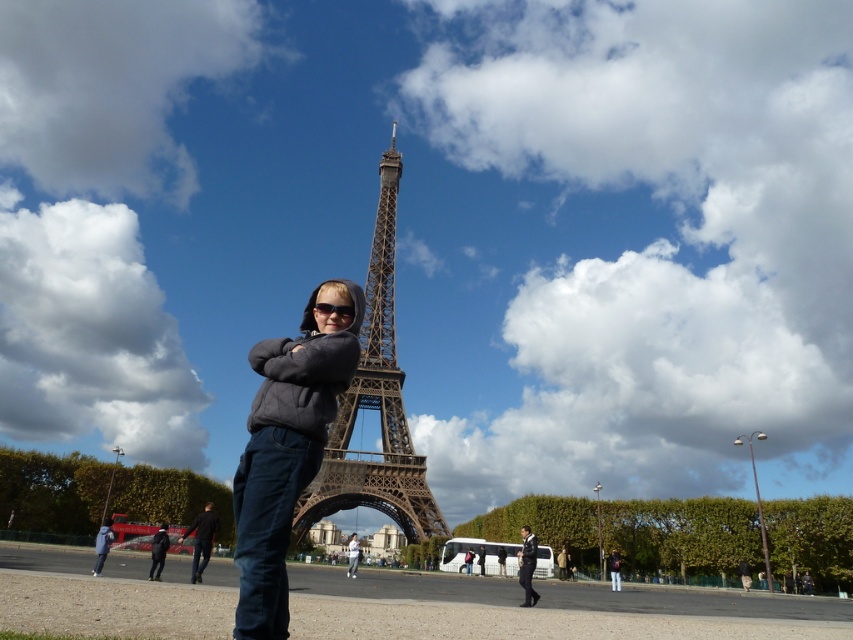
Question: Is dark blue jeans at lower left below dark blue jeans at lower center?

Choices:
 (A) no
 (B) yes

Answer: (A)

Question: Is brown metal eiffel tower at center wider than dark blue jeans at lower center?

Choices:
 (A) yes
 (B) no

Answer: (A)

Question: Which point is farther to the camera?

Choices:
 (A) brown metal eiffel tower at center
 (B) dark blue jeans at lower center
 (C) dark blue jeans at lower left
 (D) matte gray hoodie at center

Answer: (B)

Question: Which point is farther to the camera?

Choices:
 (A) brown metal eiffel tower at center
 (B) dark blue jeans at lower left

Answer: (B)

Question: Is matte gray hoodie at center below brown metal eiffel tower at center?

Choices:
 (A) yes
 (B) no

Answer: (A)

Question: Which point is farther to the camera?

Choices:
 (A) matte gray hoodie at center
 (B) dark blue jeans at lower left

Answer: (B)